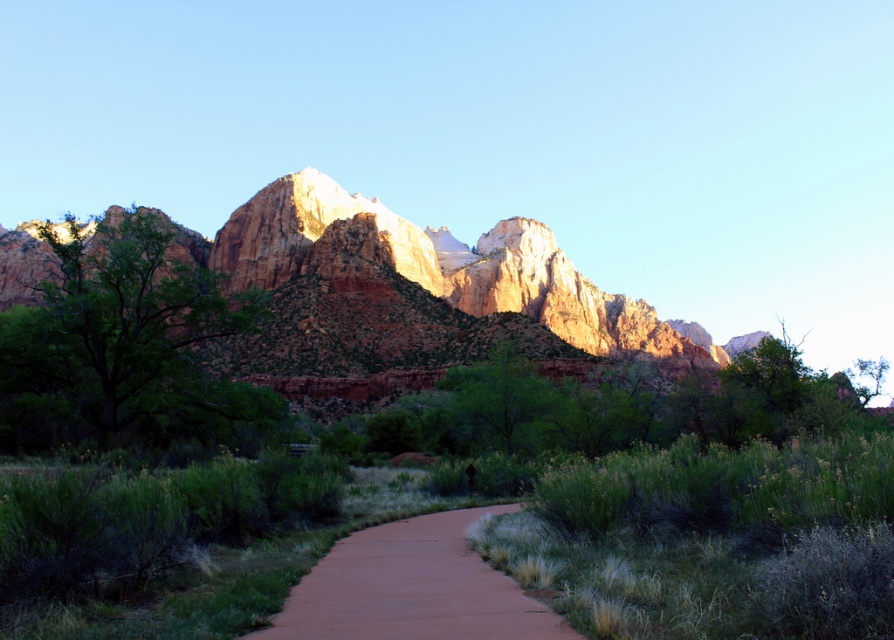
Question: Can you confirm if rustic rock formation at center is positioned to the right of brown dirt path at center?

Choices:
 (A) no
 (B) yes

Answer: (B)

Question: Which of the following is the farthest from the observer?

Choices:
 (A) (462, 534)
 (B) (578, 296)

Answer: (B)

Question: Can you confirm if rustic rock formation at center is positioned above brown dirt path at center?

Choices:
 (A) no
 (B) yes

Answer: (B)

Question: Does rustic rock formation at center appear over brown dirt path at center?

Choices:
 (A) no
 (B) yes

Answer: (B)

Question: Among these objects, which one is farthest from the camera?

Choices:
 (A) rustic rock formation at center
 (B) brown dirt path at center

Answer: (A)

Question: Which of the following is the closest to the observer?

Choices:
 (A) brown dirt path at center
 (B) rustic rock formation at center

Answer: (A)